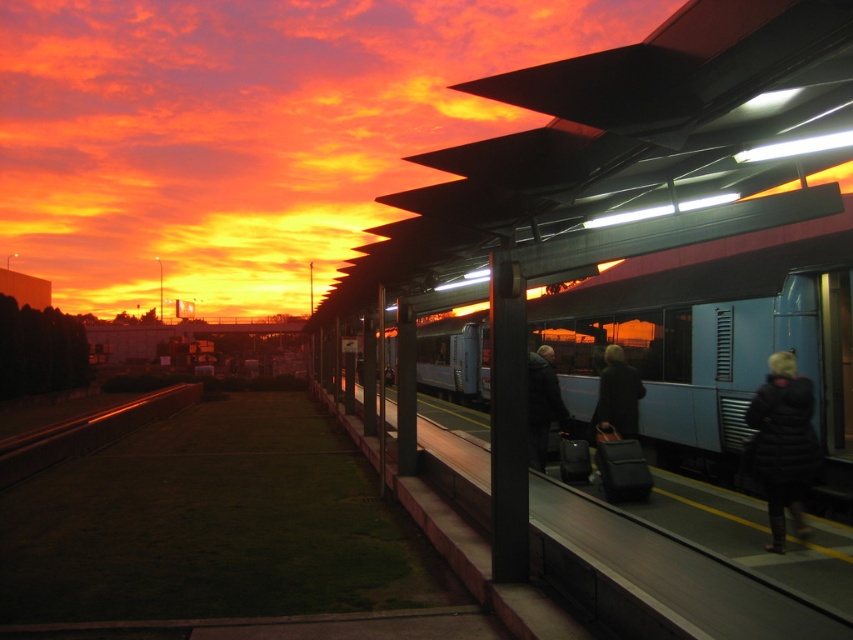
Question: Is blue metallic train at center to the right of black metal train track at lower left from the viewer's perspective?

Choices:
 (A) yes
 (B) no

Answer: (A)

Question: Which point appears closest to the camera in this image?

Choices:
 (A) (556, 406)
 (B) (646, 433)

Answer: (A)

Question: Does dark gray jacket at center come behind dark gray coat at center?

Choices:
 (A) no
 (B) yes

Answer: (A)

Question: Among these points, which one is nearest to the camera?

Choices:
 (A) (607, 339)
 (B) (138, 397)
 (C) (553, 378)
 (D) (635, 413)

Answer: (C)

Question: Is blue metallic train at center positioned before dark gray coat at center?

Choices:
 (A) yes
 (B) no

Answer: (A)

Question: Which object is positioned closest to the black metal train track at lower left?

Choices:
 (A) black puffy coat at lower right
 (B) dark gray coat at center
 (C) dark gray jacket at center
 (D) blue metallic train at center

Answer: (D)